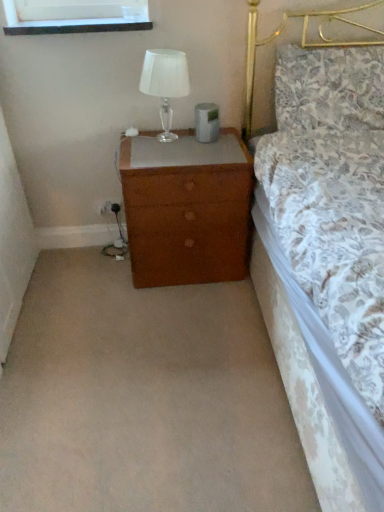
You are a GUI agent. You are given a task and a screenshot of the screen. Output one action in this format:
    pyautogui.click(x=<x>, y=<y>)
    Task: Click on the vacant space in front of brown wood chest of drawers at center
    Image resolution: width=384 pixels, height=512 pixels.
    Given the screenshot: What is the action you would take?
    pyautogui.click(x=175, y=318)